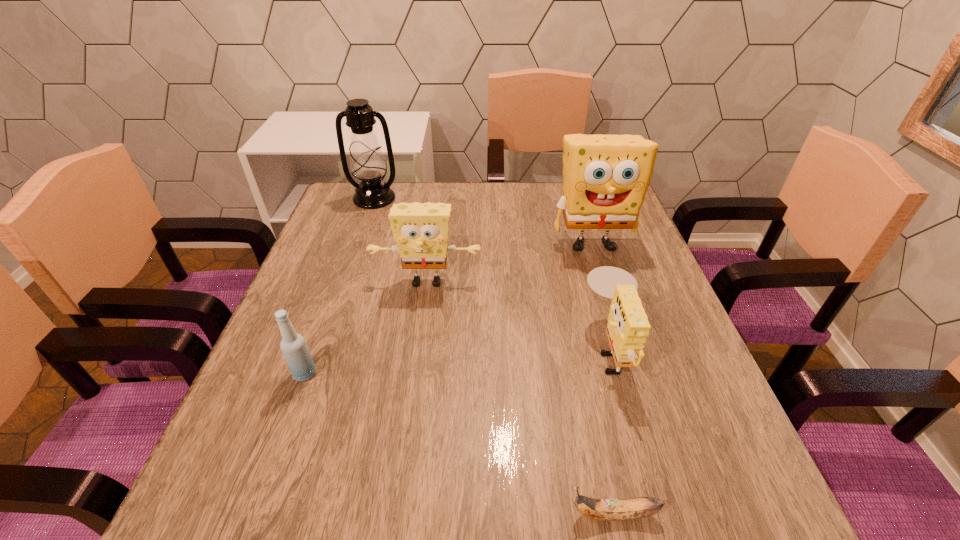
Locate an element on the screen. free space located 0.340m on the face of the tallest sponge is located at coordinates (635, 373).

I want to click on vacant space situated 0.190m on the face of the leftmost sponge, so click(x=416, y=361).

What are the coordinates of `free spot located on the back of the bottle` in the screenshot? It's located at (334, 292).

The height and width of the screenshot is (540, 960). What are the coordinates of `free space located on the front-facing side of the nearest sponge` in the screenshot? It's located at (474, 349).

Where is `vacant point located on the front-facing side of the nearest sponge`? vacant point located on the front-facing side of the nearest sponge is located at coordinates (513, 349).

The height and width of the screenshot is (540, 960). Identify the location of vacant space situated on the front-facing side of the nearest sponge. (391, 349).

Identify the location of free space located on the peel of the nearest object. (422, 514).

At what (x,y) coordinates should I click in order to perform the action: click on free space located 0.220m on the peel of the nearest object. Please return your answer as a coordinate pair (x, y). This screenshot has width=960, height=540. Looking at the image, I should click on (422, 514).

Find the location of a particular element. The image size is (960, 540). vacant point located 0.190m on the peel of the nearest object is located at coordinates (443, 514).

This screenshot has width=960, height=540. What are the coordinates of `object located at the far edge` in the screenshot? It's located at point(367,163).